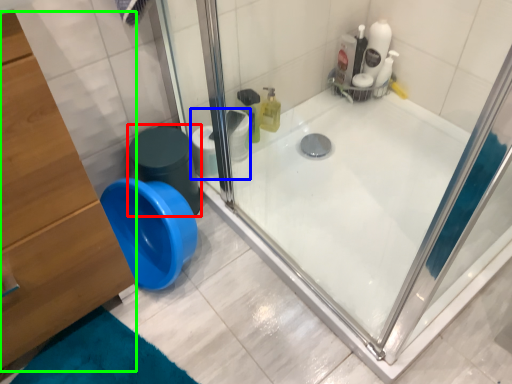
Question: Which object is positioned closest to potty (highlighted by a red box)? Select from toilet paper (highlighted by a blue box) and dresser (highlighted by a green box).

Choices:
 (A) toilet paper
 (B) dresser

Answer: (A)